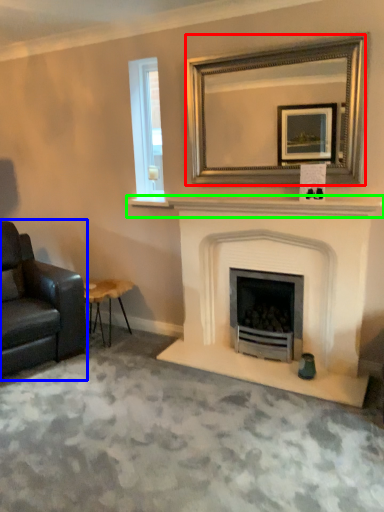
Question: Based on their relative distances, which object is farther from mirror (highlighted by a red box)? Choose from chair (highlighted by a blue box) and mantle (highlighted by a green box).

Choices:
 (A) chair
 (B) mantle

Answer: (A)